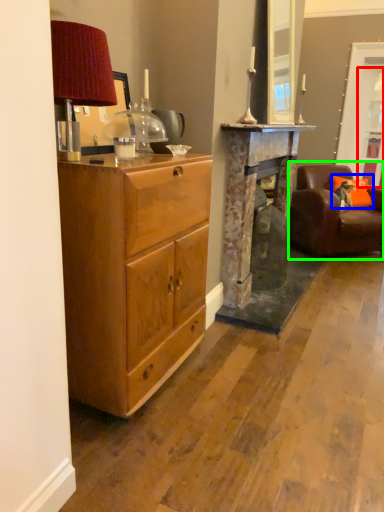
Question: Which is farther away from glass door (highlighted by a red box)? pillow (highlighted by a blue box) or chair (highlighted by a green box)?

Choices:
 (A) pillow
 (B) chair

Answer: (B)